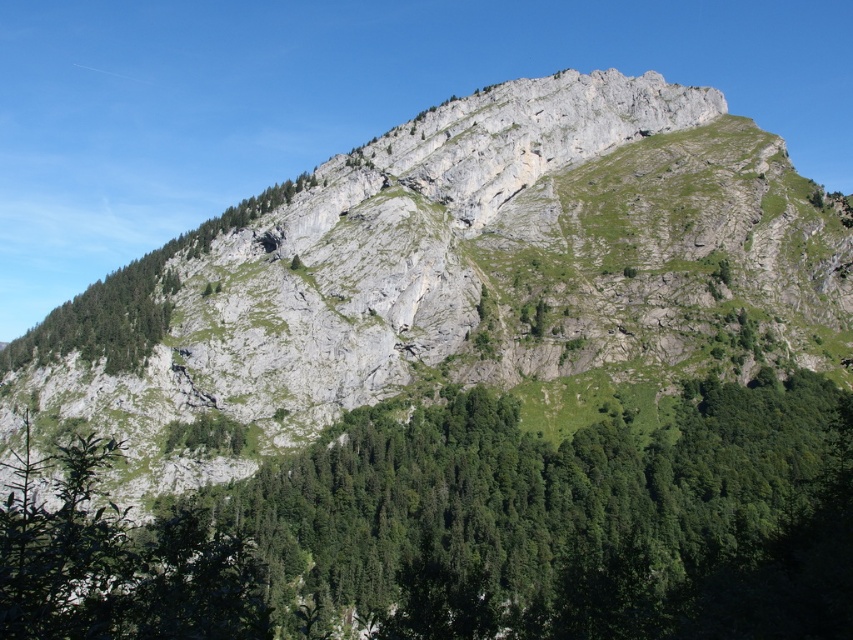
In the scene shown: Does gray rock mountain at center appear under green leafy tree at left?

No, gray rock mountain at center is not below green leafy tree at left.

Who is more forward, (364, 237) or (76, 304)?

Point (364, 237) is more forward.

The height and width of the screenshot is (640, 853). What do you see at coordinates (468, 282) in the screenshot?
I see `gray rock mountain at center` at bounding box center [468, 282].

You are a GUI agent. You are given a task and a screenshot of the screen. Output one action in this format:
    pyautogui.click(x=<x>, y=<y>)
    Task: Click on the gray rock mountain at center
    This screenshot has height=640, width=853.
    Given the screenshot: What is the action you would take?
    click(468, 282)

Is point (544, 308) positioned after point (386, 538)?

Yes, it is.

Does gray rock mountain at center have a larger size compared to green leafy trees at center?

Yes, gray rock mountain at center is bigger than green leafy trees at center.

I want to click on gray rock mountain at center, so click(468, 282).

Can you confirm if green leafy trees at center is shorter than green leafy tree at left?

Indeed, green leafy trees at center has a lesser height compared to green leafy tree at left.

Is green leafy trees at center above green leafy tree at left?

No, green leafy trees at center is not above green leafy tree at left.

This screenshot has width=853, height=640. I want to click on green leafy trees at center, so click(x=477, y=531).

At what (x,y) coordinates should I click in order to perform the action: click on green leafy trees at center. Please return your answer as a coordinate pair (x, y). This screenshot has width=853, height=640. Looking at the image, I should click on (477, 531).